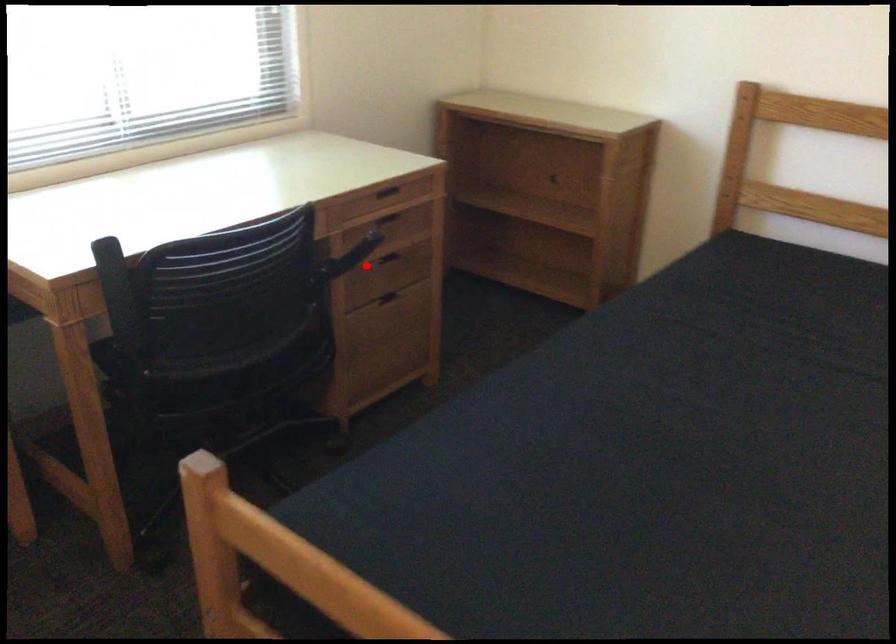
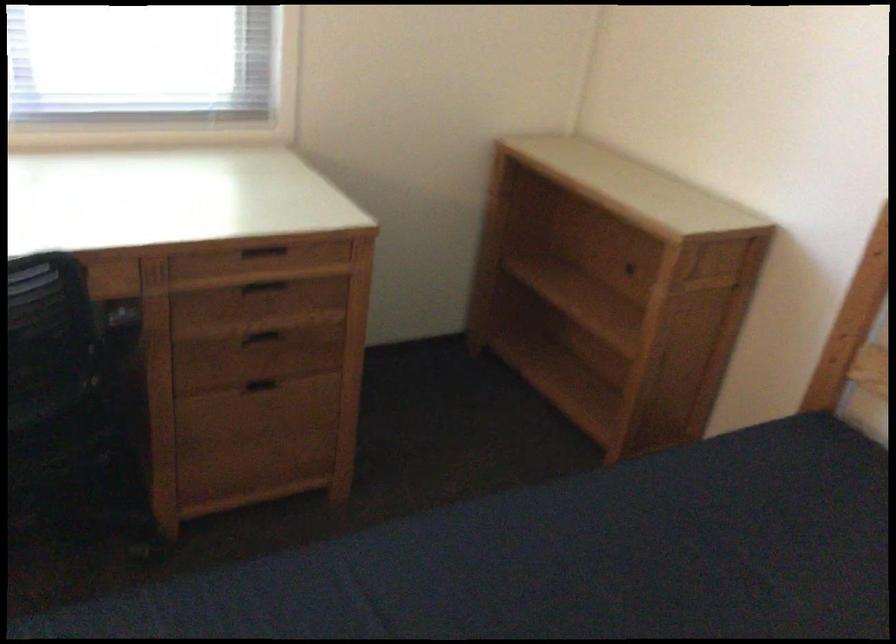
The point at the highlighted location is marked in the first image. Where is the corresponding point in the second image?

(264, 333)